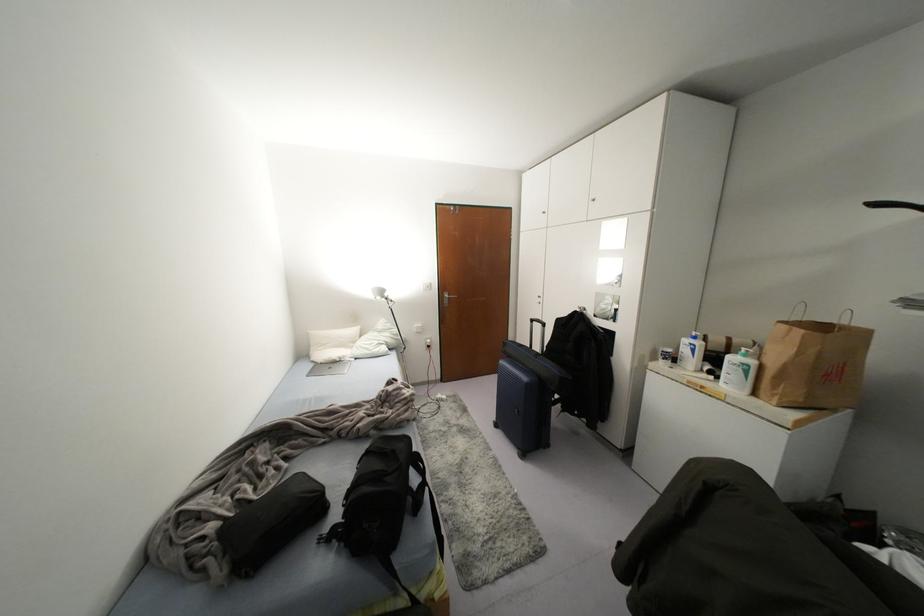
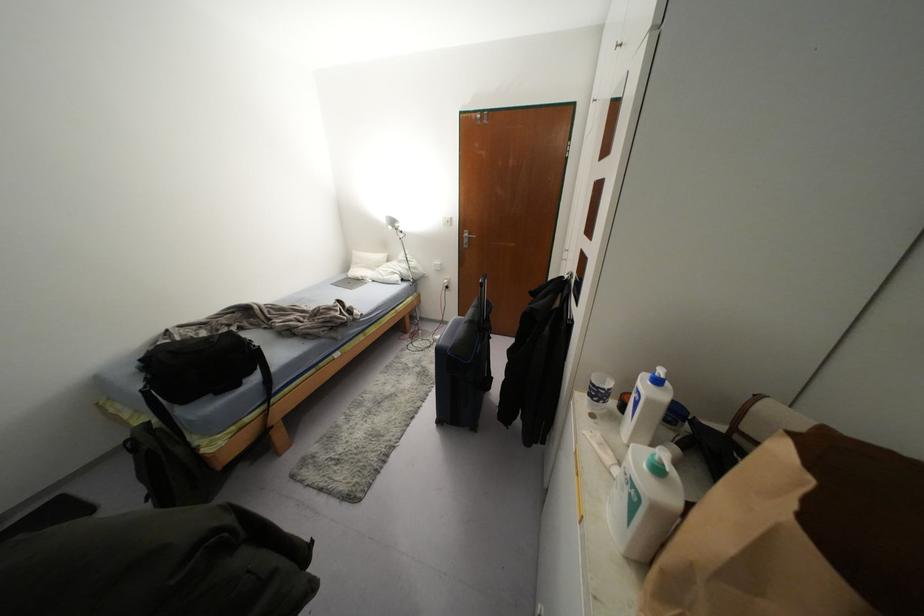
In the second image, find the point that corresponds to point 745,371 in the first image.

(633, 505)